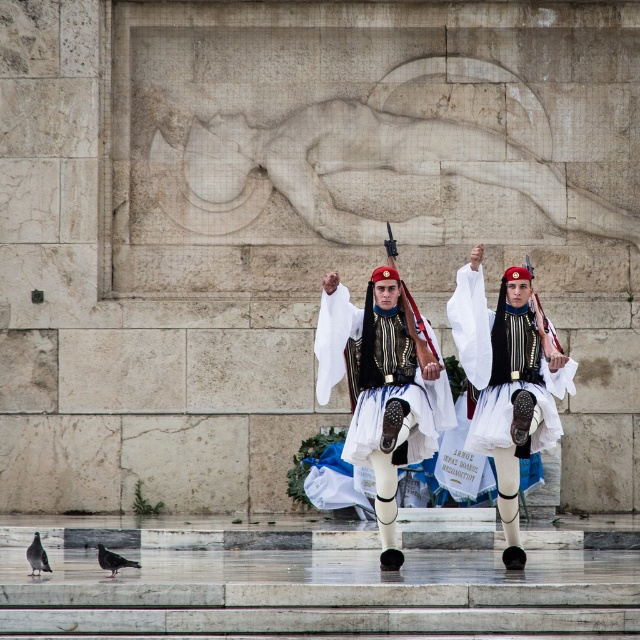
Who is more forward, [540,432] or [109,568]?

Positioned in front is point [109,568].

Is point (477, 310) behind point (122, 561)?

That is True.

Between point (516, 550) and point (122, 560), which one is positioned behind?

The point (516, 550) is more distant.

Where is `white cotton uniform at center`? white cotton uniform at center is located at coordinates (508, 380).

Which is more to the right, dark gray feathered pigeon at lower left or gray feathered pigeon at lower left?

dark gray feathered pigeon at lower left is more to the right.

I want to click on dark gray feathered pigeon at lower left, so click(x=113, y=561).

Between point (116, 570) and point (38, 540), which one is positioned behind?

Point (38, 540)

What are the coordinates of `dark gray feathered pigeon at lower left` in the screenshot? It's located at (113, 561).

Does white cotton uniform at center come in front of gray feathered pigeon at lower left?

That is False.

Find the location of a particular element. white cotton uniform at center is located at coordinates (508, 380).

Locate an element on the screen. Image resolution: width=640 pixels, height=640 pixels. white cotton uniform at center is located at coordinates (508, 380).